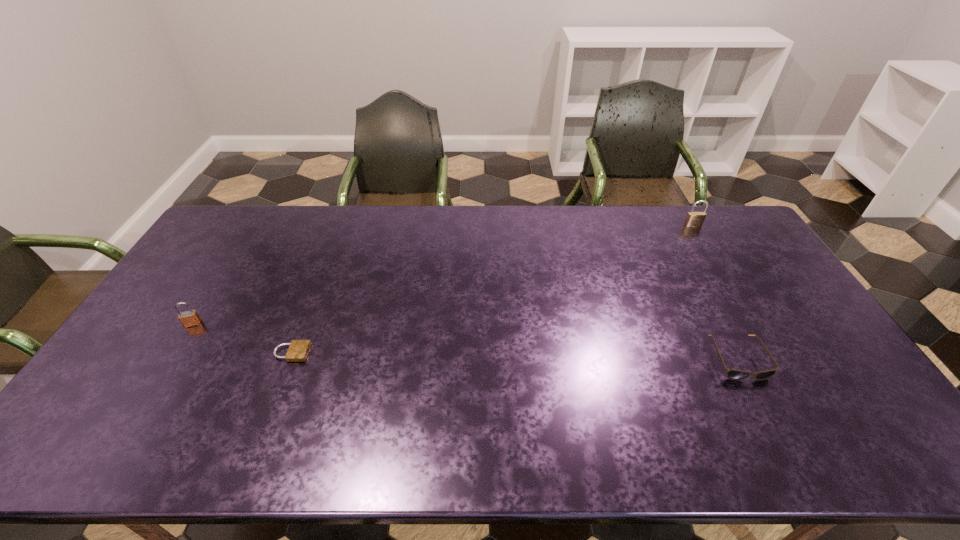
Where is `free space between the third shortest object and the second padlock from right to left`? This screenshot has width=960, height=540. free space between the third shortest object and the second padlock from right to left is located at coordinates (243, 338).

I want to click on vacant area that lies between the second shortest object and the second tallest object, so click(x=466, y=341).

Identify the location of vacant space that is in between the second shortest object and the third shortest object. (466, 341).

Image resolution: width=960 pixels, height=540 pixels. I want to click on free point between the second farthest padlock and the second shortest object, so click(466, 341).

Identify the location of vacant point located between the third tallest object and the second padlock from left to right. Image resolution: width=960 pixels, height=540 pixels. (515, 356).

The width and height of the screenshot is (960, 540). Find the location of `free point between the third nearest object and the tallest padlock`. free point between the third nearest object and the tallest padlock is located at coordinates (443, 274).

Image resolution: width=960 pixels, height=540 pixels. In order to click on vacant point located between the sunglasses and the tallest padlock in this screenshot , I will do `click(715, 292)`.

This screenshot has height=540, width=960. I want to click on vacant area that lies between the farthest padlock and the leftmost padlock, so click(x=443, y=274).

At what (x,y) coordinates should I click in order to perform the action: click on free space between the farthest padlock and the third tallest object. Please return your answer as a coordinate pair (x, y). The width and height of the screenshot is (960, 540). Looking at the image, I should click on (715, 292).

The height and width of the screenshot is (540, 960). Identify the location of free spot between the second shortest object and the second nearest padlock. (466, 341).